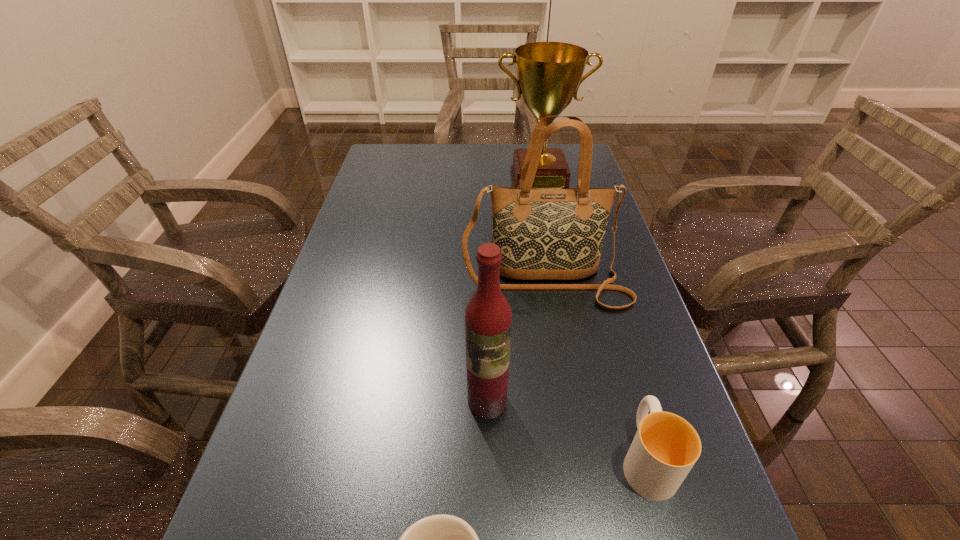
At what (x,y) coordinates should I click in order to perform the action: click on award. Please return your answer as a coordinate pair (x, y). Looking at the image, I should click on pos(549,74).

Find the location of a particular element. The height and width of the screenshot is (540, 960). the second farthest object is located at coordinates (543, 233).

You are a GUI agent. You are given a task and a screenshot of the screen. Output one action in this format:
    pyautogui.click(x=<x>, y=<y>)
    Task: Click on the third farthest object
    This screenshot has height=540, width=960.
    Given the screenshot: What is the action you would take?
    pyautogui.click(x=488, y=318)

Where is `the fourth farthest object`? This screenshot has height=540, width=960. the fourth farthest object is located at coordinates (665, 448).

I want to click on vacant point located 0.270m on the plaque of the award, so click(x=553, y=253).

Identify the location of vacant space located on the front-facing side of the fourth nearest object. (566, 412).

Where is `vacant area located on the label of the liquor`? This screenshot has width=960, height=540. vacant area located on the label of the liquor is located at coordinates point(489,501).

I want to click on blank space located 0.150m with the handle on the side of the second nearest object, so click(x=616, y=354).

At what (x,y) coordinates should I click in order to perform the action: click on vacant point located with the handle on the side of the second nearest object. Please return your answer as a coordinate pair (x, y). This screenshot has height=540, width=960. Looking at the image, I should click on (602, 305).

Find the location of a particular element. free space located 0.140m with the handle on the side of the second nearest object is located at coordinates (617, 358).